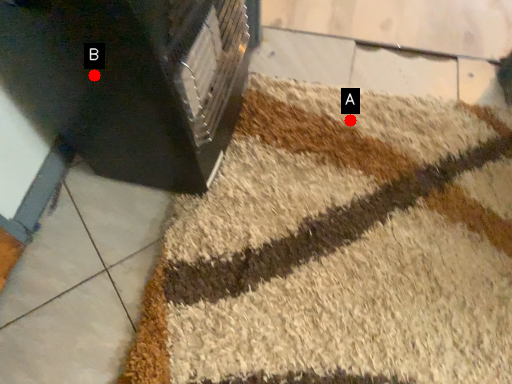
Question: Two points are circled on the image, labeled by A and B beside each circle. Which point appears farthest from the camera in this image?

Choices:
 (A) A is further
 (B) B is further

Answer: (A)